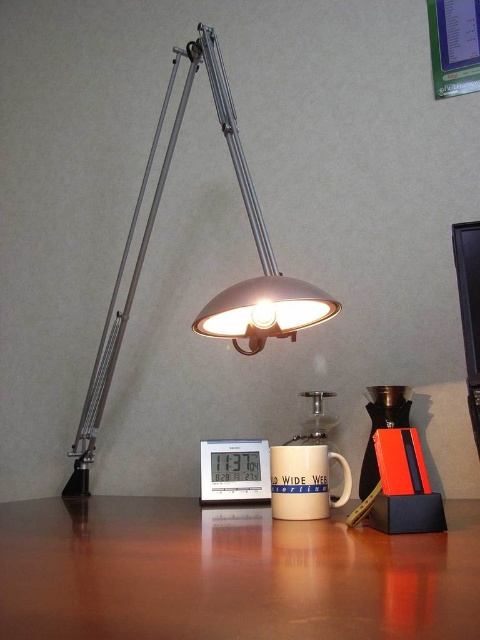
Does metallic desk lamp at upper left appear over white plastic digital clock at center?

Yes, metallic desk lamp at upper left is above white plastic digital clock at center.

Where is `metallic desk lamp at upper left`? metallic desk lamp at upper left is located at coordinates (217, 292).

Locate an element on the screen. The height and width of the screenshot is (640, 480). metallic desk lamp at upper left is located at coordinates (217, 292).

Is metallic desk lamp at upper left closer to the viewer compared to black glossy monitor at upper right?

Yes.

Can you confirm if metallic desk lamp at upper left is wider than black glossy monitor at upper right?

Indeed, metallic desk lamp at upper left has a greater width compared to black glossy monitor at upper right.

What do you see at coordinates (217, 292) in the screenshot? I see `metallic desk lamp at upper left` at bounding box center [217, 292].

At what (x,y) coordinates should I click in order to perform the action: click on metallic desk lamp at upper left. Please return your answer as a coordinate pair (x, y). This screenshot has height=640, width=480. Looking at the image, I should click on (217, 292).

Measure the distance between point (294, 445) and camera.

Point (294, 445) and camera are 1.07 meters apart.

Is white matte mug at center behind black glossy monitor at upper right?

That is True.

Is point (345, 497) less distant than point (471, 269)?

Yes, point (345, 497) is in front of point (471, 269).

Where is `white matte mug at center`? white matte mug at center is located at coordinates (304, 481).